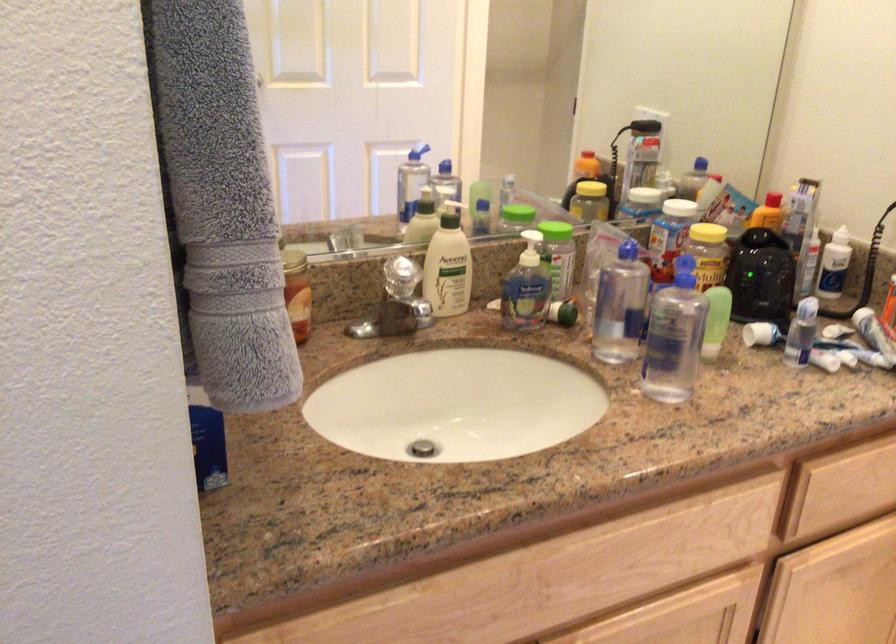
I want to click on white product tube, so click(x=839, y=339).